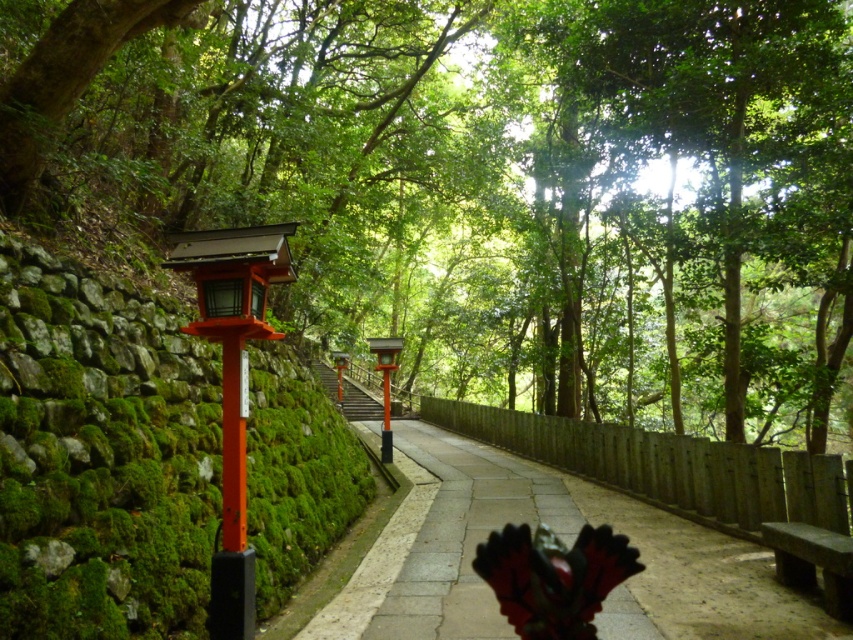
Question: Is the position of green leafy tree at center less distant than that of dark gray stone bench at lower right?

Choices:
 (A) yes
 (B) no

Answer: (B)

Question: Among these objects, which one is nearest to the camera?

Choices:
 (A) dark gray stone bench at lower right
 (B) green leafy tree at center

Answer: (A)

Question: In this image, where is green leafy tree at center located relative to dark gray stone bench at lower right?

Choices:
 (A) right
 (B) left

Answer: (B)

Question: Which object is farther from the camera taking this photo?

Choices:
 (A) green leafy tree at center
 (B) dark gray stone bench at lower right

Answer: (A)

Question: Which of the following is the farthest from the observer?

Choices:
 (A) green leafy tree at center
 (B) dark gray stone bench at lower right

Answer: (A)

Question: Is green leafy tree at center wider than dark gray stone bench at lower right?

Choices:
 (A) yes
 (B) no

Answer: (A)